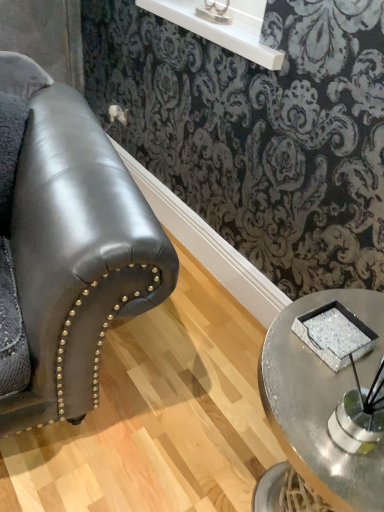
The width and height of the screenshot is (384, 512). I want to click on free area in between metallic silver tray at lower right and sparkly silver tray at center, so click(x=319, y=373).